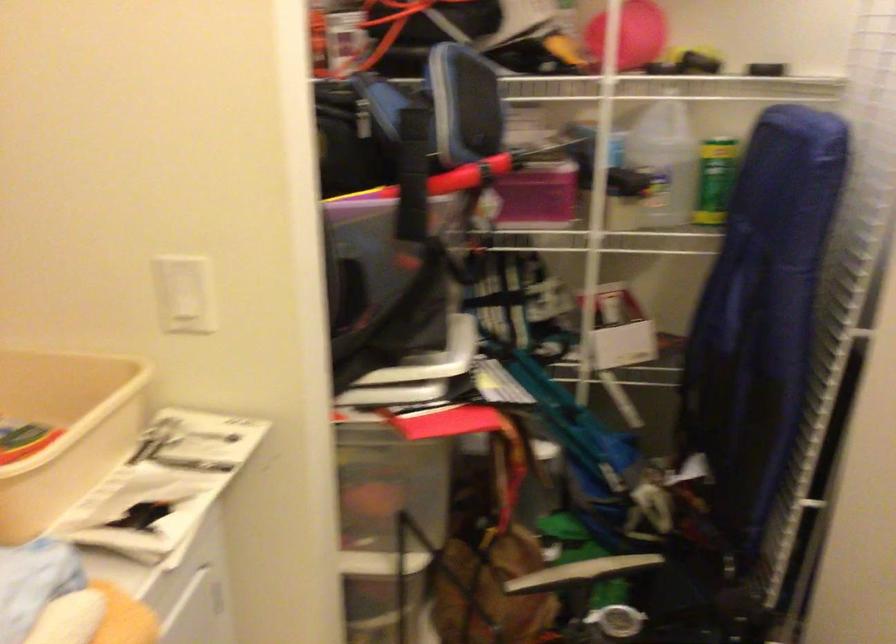
First-person continuous shooting, in which direction is the camera rotating?

The camera's rotation is toward right-up.